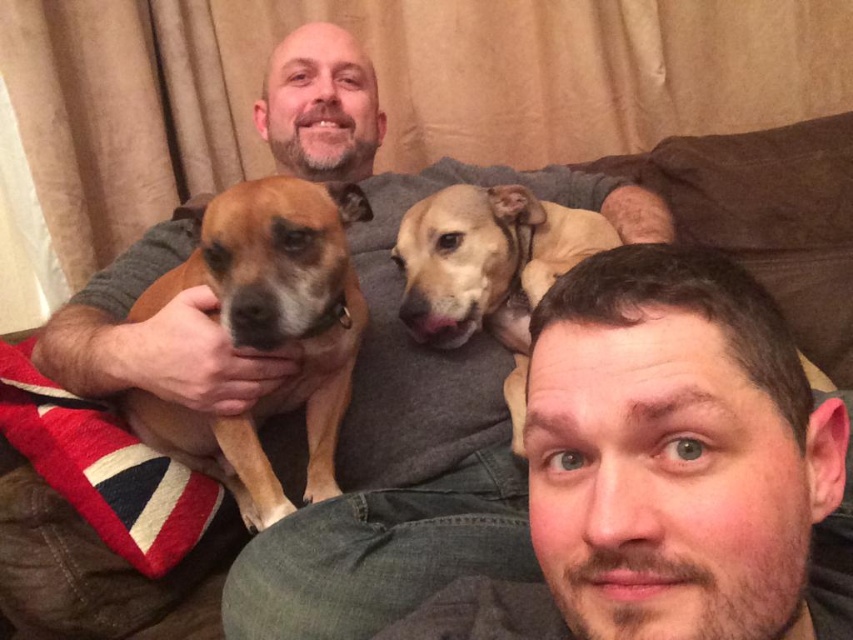
Can you confirm if brown fur dog at left is shorter than fuzzy brown dog at center?

Incorrect, brown fur dog at left's height does not fall short of fuzzy brown dog at center's.

In the scene shown: Can you confirm if brown fur dog at left is wider than fuzzy brown dog at center?

Yes.

Is point (244, 193) farther from camera compared to point (430, 324)?

No, (244, 193) is in front of (430, 324).

Locate an element on the screen. The image size is (853, 640). brown fur dog at left is located at coordinates (265, 330).

Is point (628, 294) positioned in front of point (492, 332)?

Yes.

Is smooth brown dog at upper center positioned in front of fuzzy brown dog at center?

That is True.

Which is in front, point (697, 513) or point (505, 285)?

Point (697, 513)

Locate an element on the screen. smooth brown dog at upper center is located at coordinates (665, 467).

Does smooth brown dog at upper center have a lesser width compared to brown fur dog at left?

No.

Is smooth brown dog at upper center behind brown fur dog at left?

No.

Which is behind, point (607, 380) or point (337, 371)?

The point (337, 371) is behind.

The image size is (853, 640). In order to click on smooth brown dog at upper center in this screenshot , I will do `click(665, 467)`.